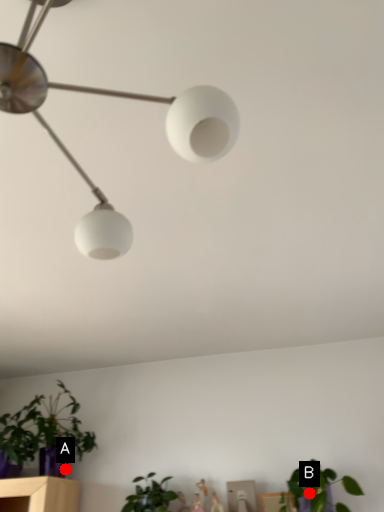
Question: Two points are circled on the image, labeled by A and B beside each circle. Which point appears closest to the camera in this image?

Choices:
 (A) A is closer
 (B) B is closer

Answer: (B)